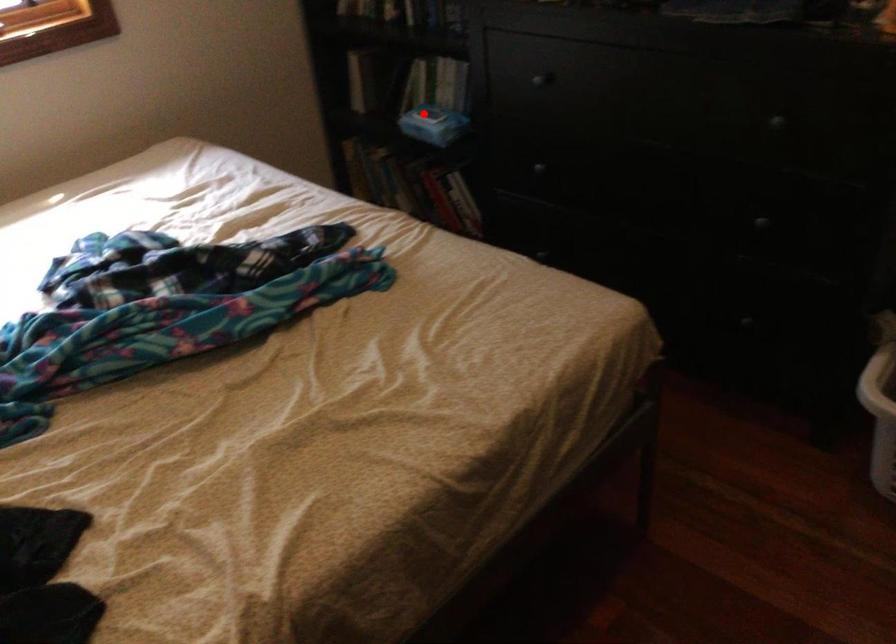
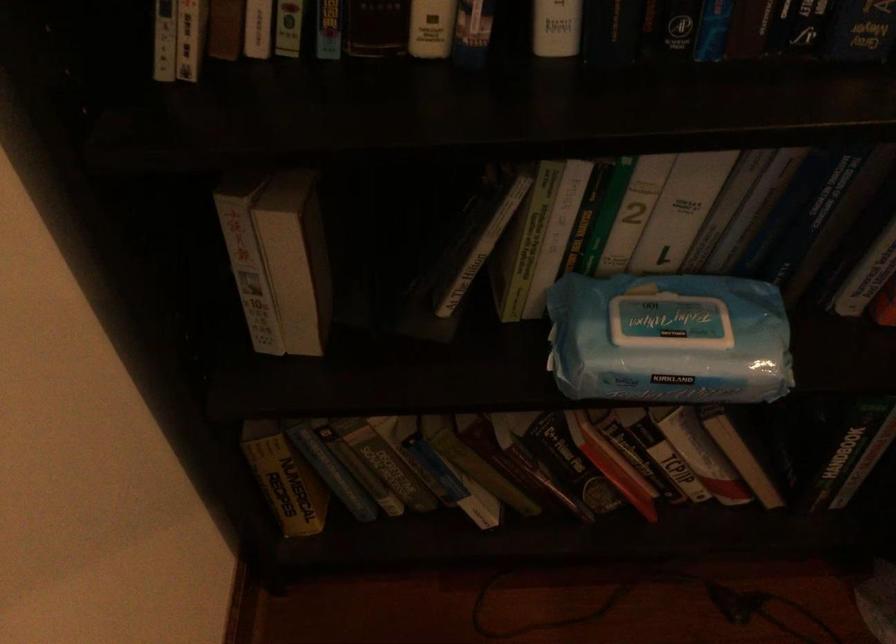
Question: I am providing you with two images of the same scene from different viewpoints. Image1 has a red point marked. In image2, the corresponding 3D location appears at what relative position? Reply with the corresponding letter.

Choices:
 (A) Closer
 (B) Farther

Answer: (A)